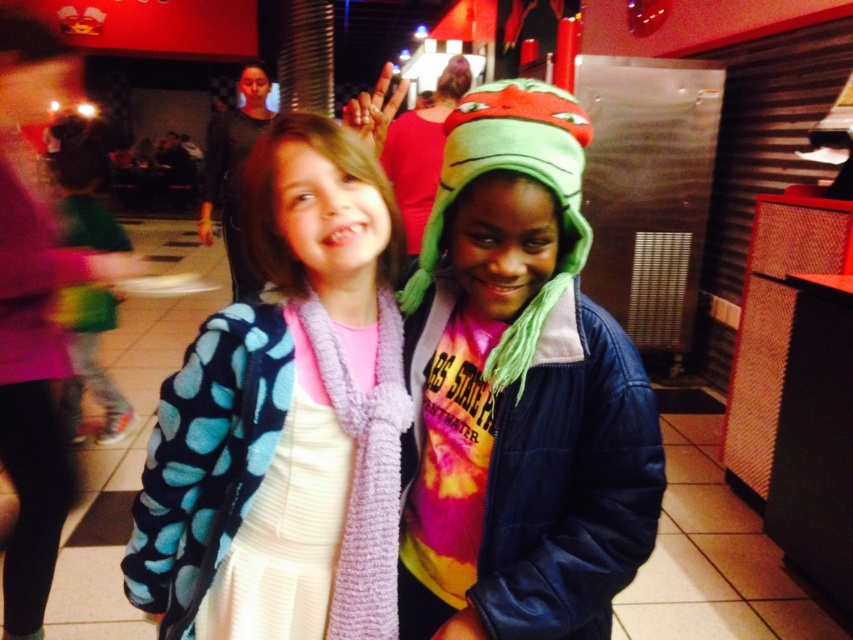
Question: Does green plush hat at center have a lesser width compared to blue polka dot fleece jacket at center?

Choices:
 (A) yes
 (B) no

Answer: (A)

Question: Can you confirm if green plush hat at center is positioned below blue polka dot fleece jacket at center?

Choices:
 (A) no
 (B) yes

Answer: (A)

Question: Is green plush hat at center behind blue polka dot fleece jacket at center?

Choices:
 (A) no
 (B) yes

Answer: (A)

Question: Which point is farther from the camera taking this photo?

Choices:
 (A) (184, 412)
 (B) (490, 483)

Answer: (A)